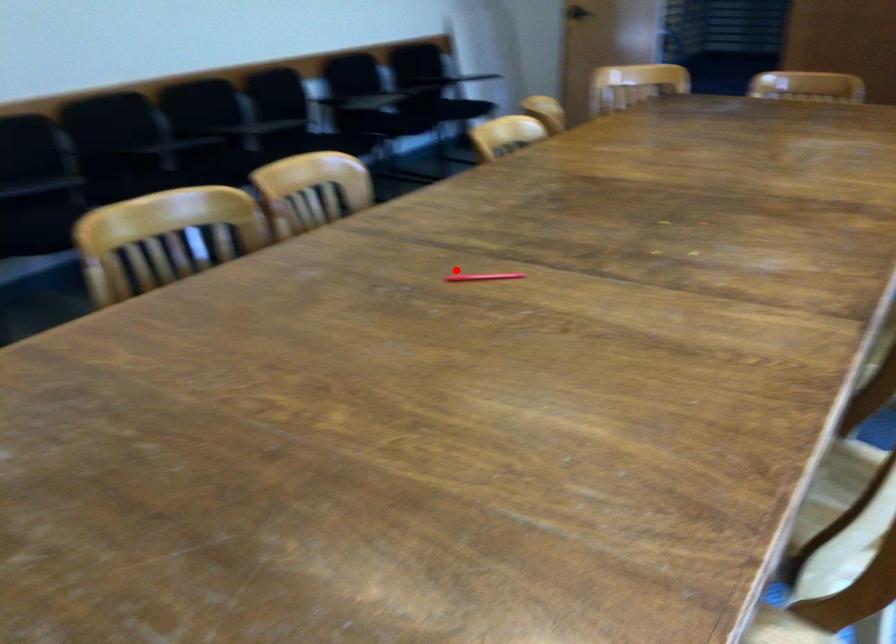
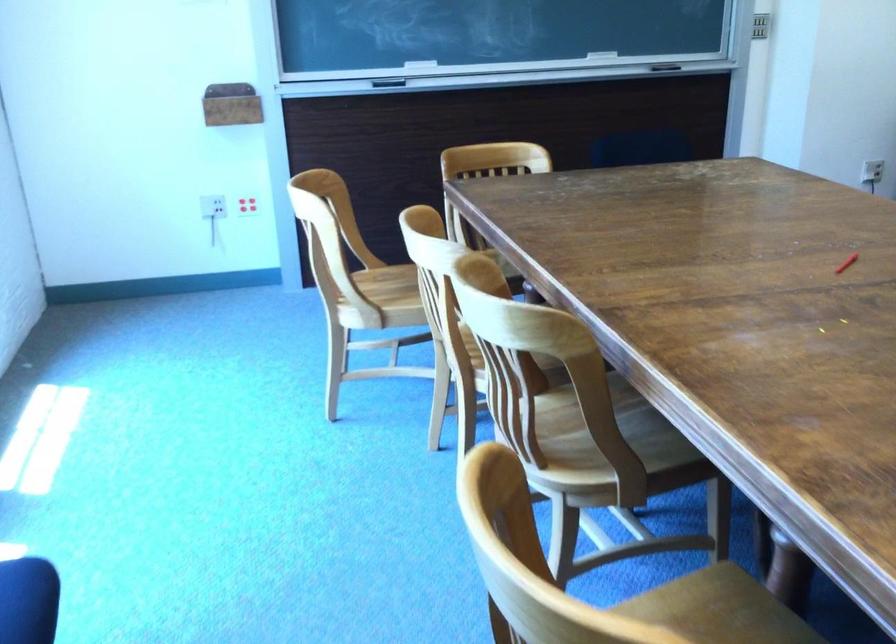
The point at the highlighted location is marked in the first image. Where is the corresponding point in the second image?

(846, 263)